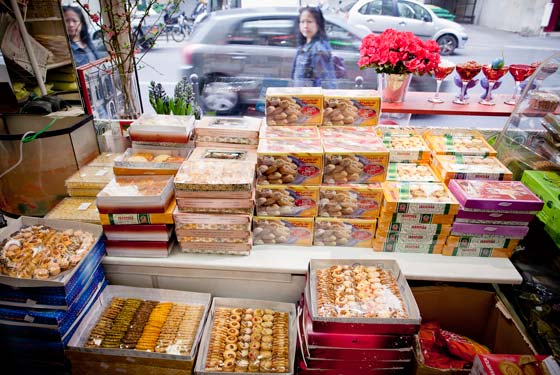
Locate an element on the screen. The width and height of the screenshot is (560, 375). counter top is located at coordinates (282, 260).